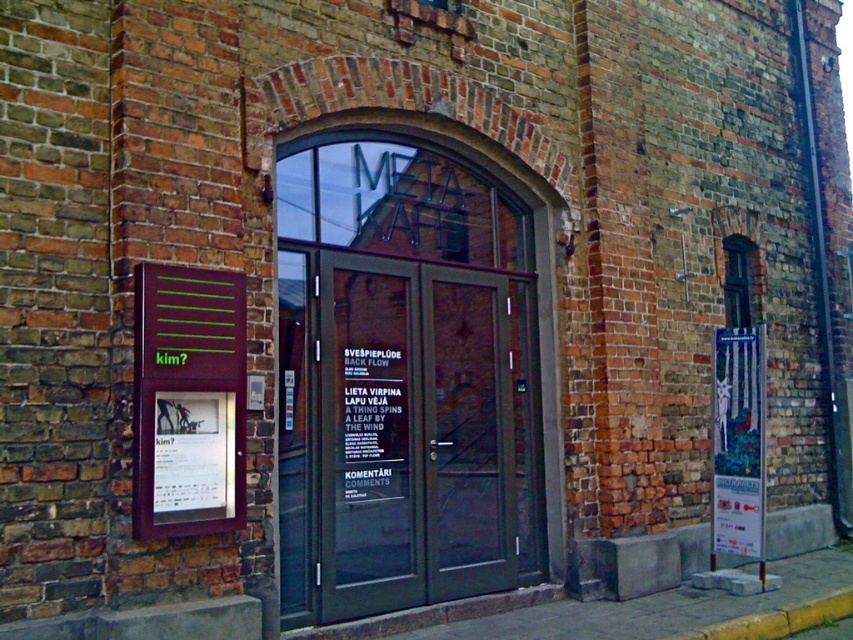
From the picture: You are standing in front of the entrance to META KAFE. You see the green glass doors at center and the matte purple signboard at left. Which object is positioned higher relative to the other?

The green glass doors at center is positioned higher than the matte purple signboard at left.

You are a delivery person trying to enter the building through the entrance. You need to know which object is taller to avoid hitting your head. Which one is taller between the green glass door at center and the metallic poster at right?

The green glass door at center is much taller than the metallic poster at right, so you should be cautious of the green glass door at center to avoid hitting your head.

You are standing in front of the entrance to META KAFE. There is a point at coordinates (x=403, y=380). Which object does this point correspond to?

The point at coordinates (x=403, y=380) corresponds to the green glass doors at center.